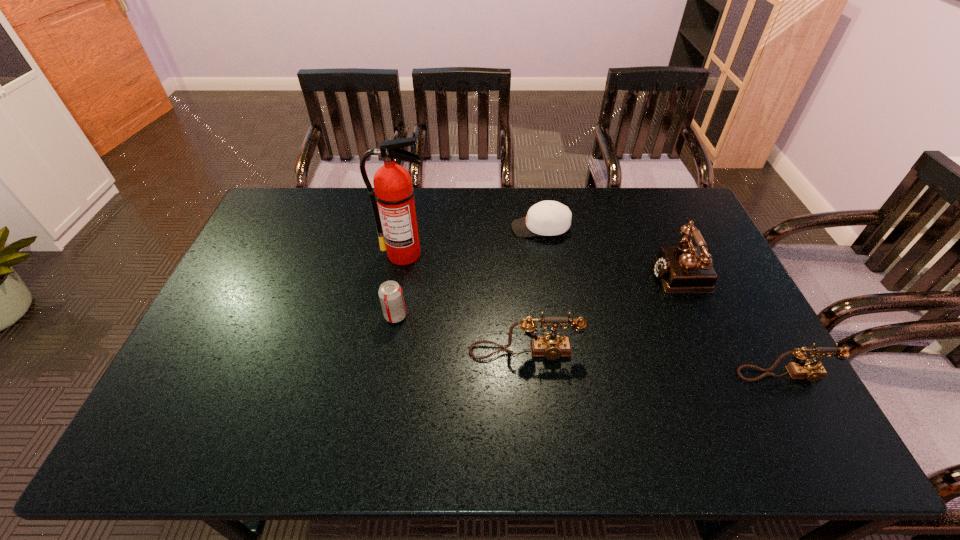
Find the location of a particular element. The height and width of the screenshot is (540, 960). telephone that is the third nearest to the soda can is located at coordinates click(x=802, y=368).

Find the location of a particular element. free space that satisfies the following two spatial constraints: 1. on the dial of the farthest telephone; 2. on the front-facing side of the third tallest object is located at coordinates (718, 352).